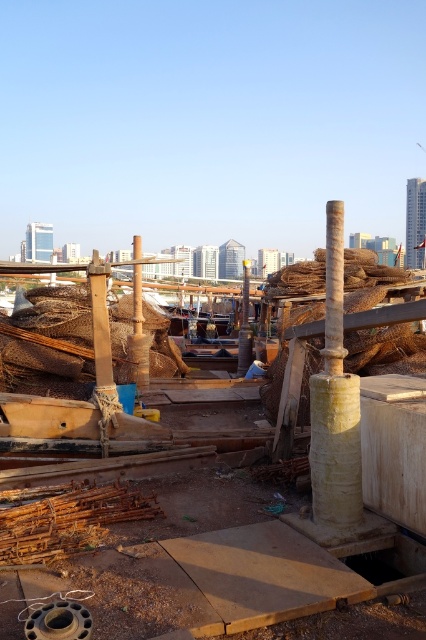
You are a dock worker inspecting the equipment at the waterfront. You notice the rusty wire mesh at center and the matte brown pole at center. Which object is located below the other?

The rusty wire mesh at center is positioned under the matte brown pole at center, so the wire mesh is below the pole.

You are a dock worker who needs to secure the brown woven netting at center to the matte brown pole at center. Based on the scene, can you determine the position of the netting relative to the pole?

The brown woven netting at center is located below the matte brown pole at center, so you can secure it by attaching it to the lower part of the pole.

You are a marine biologist examining the waterfront scene. You notice the rusty wire mesh at center. Based on its position, can you determine if it is closer to the foreground or the middle ground?

The rusty wire mesh at center is located at point (52, 337), which places it in the middle ground of the scene.